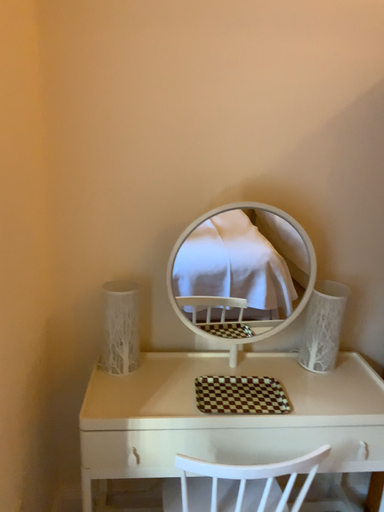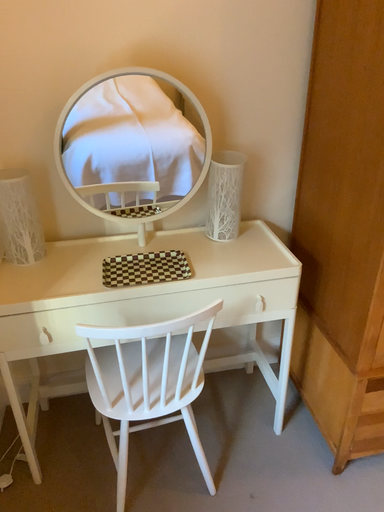
Question: Which way did the camera rotate in the video?

Choices:
 (A) rotated right
 (B) rotated left

Answer: (A)